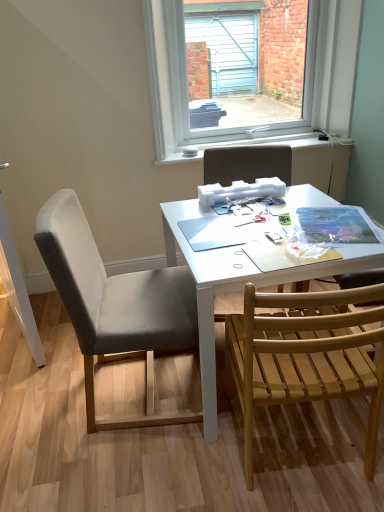
Question: From a real-world perspective, is clear glass window at upper center physically located above or below white matte table at center?

Choices:
 (A) below
 (B) above

Answer: (B)

Question: Is clear glass window at upper center to the left or to the right of white matte table at center in the image?

Choices:
 (A) right
 (B) left

Answer: (A)

Question: Which is farther from the wooden slats chair at lower right, which ranks as the 3th chair in left-to-right order?

Choices:
 (A) gray fabric chair at left, the third chair viewed from the right
 (B) gray fabric chair at center, acting as the second chair starting from the right
 (C) clear glass window at upper center
 (D) white matte table at center

Answer: (C)

Question: Which object is the farthest from the wooden slats chair at lower right, which ranks as the 3th chair in left-to-right order?

Choices:
 (A) gray fabric chair at left, acting as the first chair starting from the left
 (B) white matte table at center
 (C) gray fabric chair at center, positioned as the second chair in left-to-right order
 (D) clear glass window at upper center

Answer: (D)